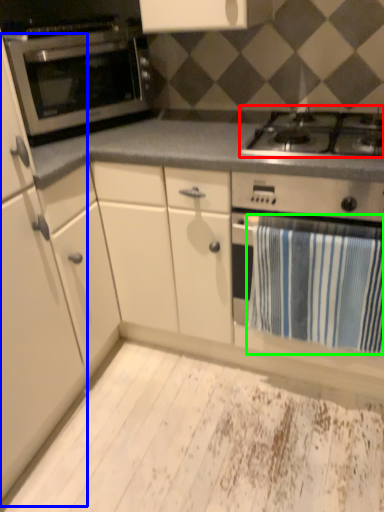
Question: Considering the real-world distances, which object is farthest from gas stove (highlighted by a red box)? cabinetry (highlighted by a blue box) or bath towel (highlighted by a green box)?

Choices:
 (A) cabinetry
 (B) bath towel

Answer: (A)